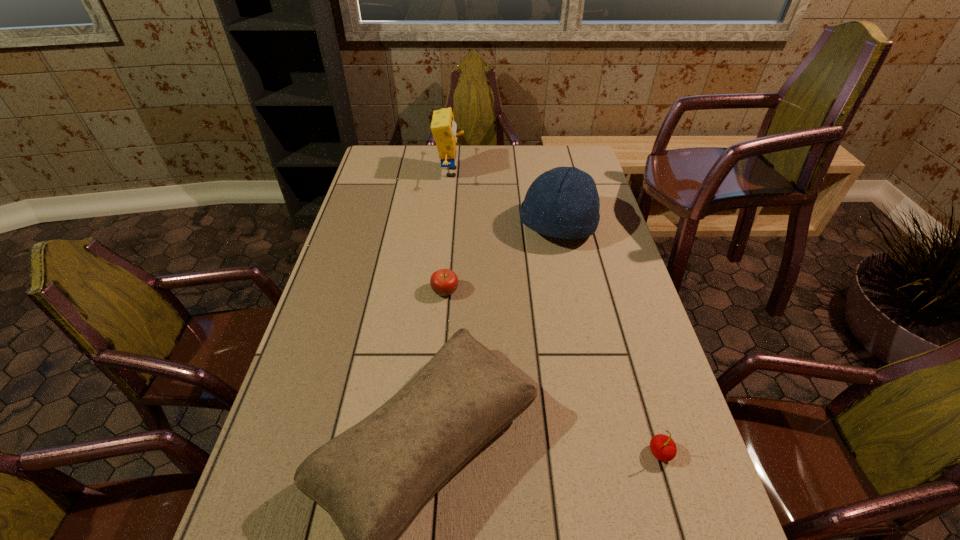
Where is `vacant position in the image that satisfies the following two spatial constraints: 1. on the face of the farthest object; 2. on the back side of the cherry`? vacant position in the image that satisfies the following two spatial constraints: 1. on the face of the farthest object; 2. on the back side of the cherry is located at coordinates (424, 453).

This screenshot has height=540, width=960. What are the coordinates of `vacant area in the image that satisfies the following two spatial constraints: 1. on the front side of the cherry; 2. on the left side of the third farthest object` in the screenshot? It's located at (432, 453).

What are the coordinates of `vacant point that satisfies the following two spatial constraints: 1. on the face of the sponge; 2. on the right side of the apple` in the screenshot? It's located at (440, 291).

Locate an element on the screen. free point that satisfies the following two spatial constraints: 1. on the face of the farthest object; 2. on the right side of the fourth nearest object is located at coordinates (445, 227).